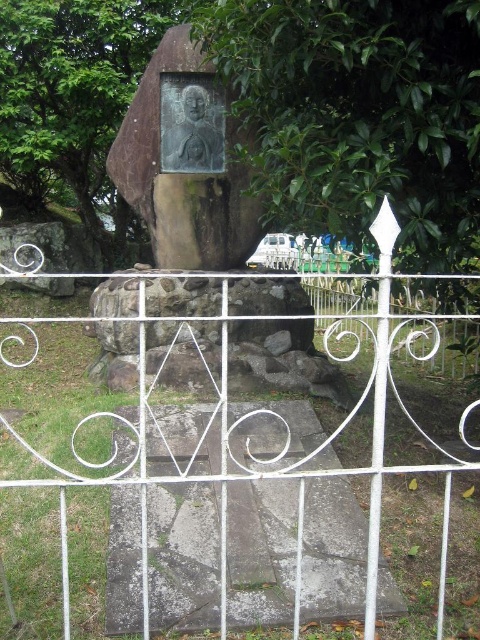
Question: Is green leafy tree at upper center further to the viewer compared to white wrought iron gate at center?

Choices:
 (A) yes
 (B) no

Answer: (A)

Question: Which point is closer to the camera?

Choices:
 (A) white wrought iron gate at center
 (B) green leafy tree at upper center

Answer: (A)

Question: Can you confirm if green leafy tree at upper center is wider than white wrought iron gate at center?

Choices:
 (A) yes
 (B) no

Answer: (B)

Question: Is green leafy tree at upper center thinner than white wrought iron gate at center?

Choices:
 (A) no
 (B) yes

Answer: (B)